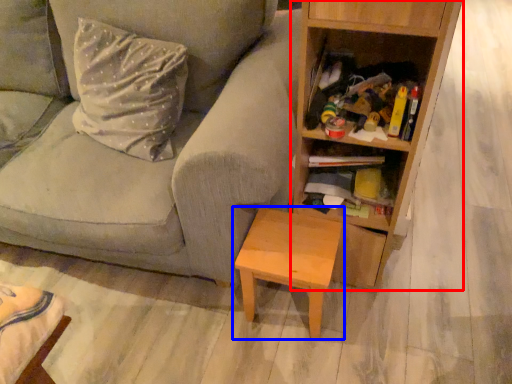
Question: Which object is further to the camera taking this photo, bookcase (highlighted by a red box) or table (highlighted by a blue box)?

Choices:
 (A) bookcase
 (B) table

Answer: (B)